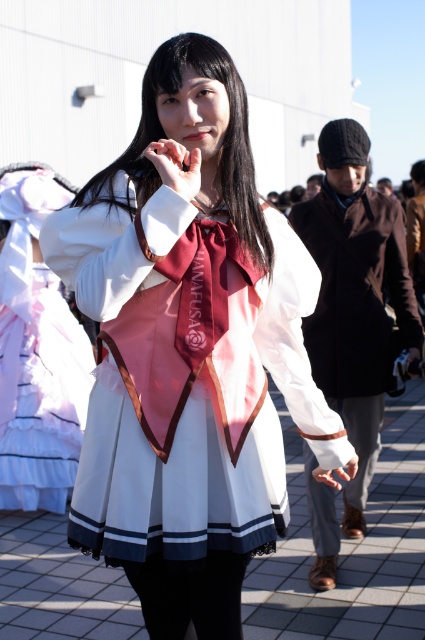
How much distance is there between white satin dress at center and leather brown wristband at lower right?

The distance of white satin dress at center from leather brown wristband at lower right is 5.53 feet.

Consider the image. Between white satin dress at center and leather brown wristband at lower right, which one is positioned higher?

white satin dress at center is above.

This screenshot has height=640, width=425. Describe the element at coordinates (183, 358) in the screenshot. I see `white satin dress at center` at that location.

The width and height of the screenshot is (425, 640). In order to click on white satin dress at center in this screenshot , I will do `click(183, 358)`.

How far apart are black velvet coat at right and matte white dress at center?

6.38 feet

Can you confirm if black velvet coat at right is smaller than matte white dress at center?

Yes, black velvet coat at right is smaller than matte white dress at center.

Locate an element on the screen. The image size is (425, 640). black velvet coat at right is located at coordinates (354, 298).

Locate an element on the screen. The height and width of the screenshot is (640, 425). black velvet coat at right is located at coordinates (354, 298).

Can you confirm if black velvet coat at right is shorter than maroon satin tie at center?

No.

Between black velvet coat at right and maroon satin tie at center, which one has more height?

Standing taller between the two is black velvet coat at right.

This screenshot has width=425, height=640. I want to click on black velvet coat at right, so click(354, 298).